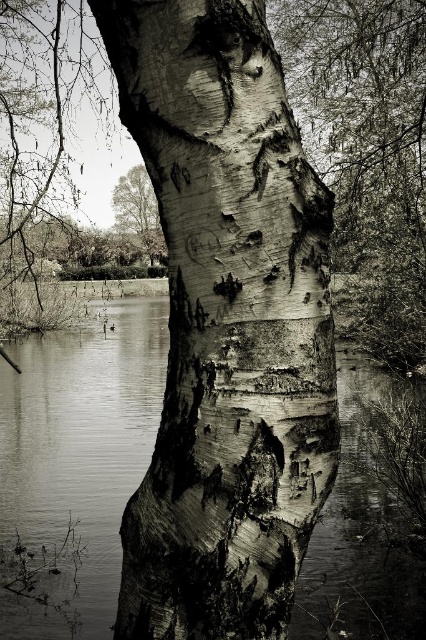
Is smooth bark tree trunk at center above smooth water at center?

Yes, smooth bark tree trunk at center is above smooth water at center.

Can you confirm if smooth bark tree trunk at center is taller than smooth water at center?

No, smooth bark tree trunk at center is not taller than smooth water at center.

In order to click on smooth bark tree trunk at center in this screenshot , I will do `click(226, 324)`.